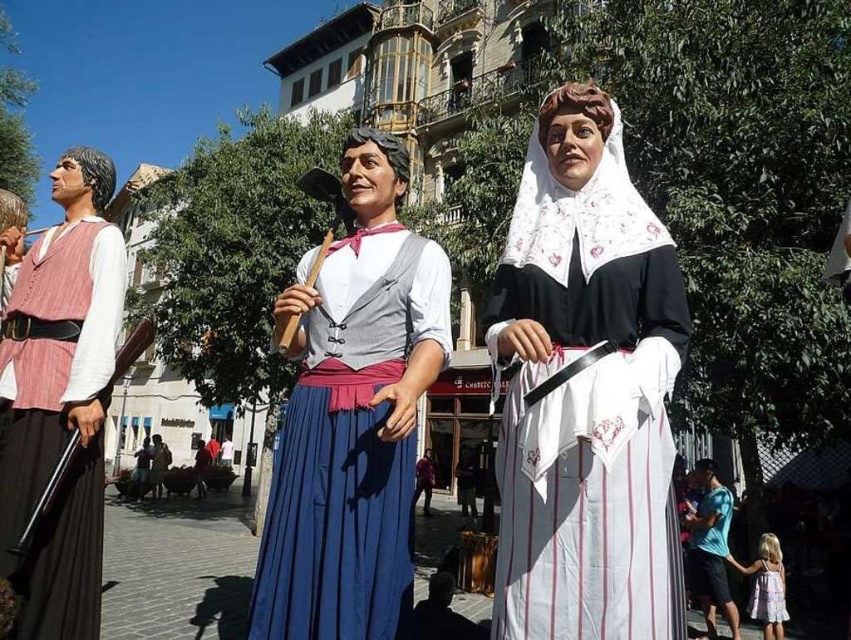
Can you confirm if white striped fabric dress at center is taller than blue fabric skirt at center?

No.

I want to click on white striped fabric dress at center, so click(768, 593).

Can you confirm if blue pleated skirt at center is positioned to the left of blue fabric skirt at center?

In fact, blue pleated skirt at center is to the right of blue fabric skirt at center.

Between blue pleated skirt at center and blue fabric skirt at center, which one has more height?

blue pleated skirt at center is taller.

Find the location of a particular element. This screenshot has width=851, height=640. blue pleated skirt at center is located at coordinates (350, 451).

Where is `blue pleated skirt at center`? This screenshot has height=640, width=851. blue pleated skirt at center is located at coordinates (350, 451).

The height and width of the screenshot is (640, 851). Describe the element at coordinates (710, 545) in the screenshot. I see `blue cotton t-shirt at center` at that location.

Which of these two, blue cotton t-shirt at center or white striped fabric dress at center, stands taller?

white striped fabric dress at center

Is point (698, 531) closer to viewer compared to point (757, 573)?

No, (698, 531) is behind (757, 573).

The width and height of the screenshot is (851, 640). Identify the location of blue cotton t-shirt at center. (710, 545).